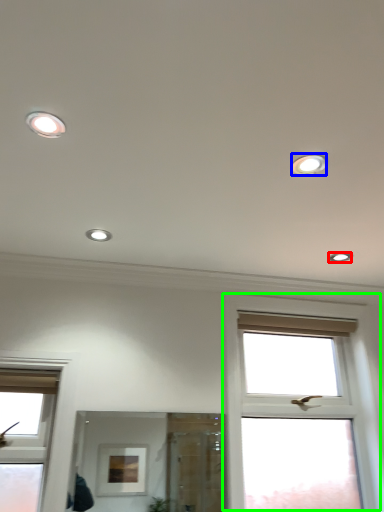
Question: Which object is positioned farthest from dot (highlighted by a red box)? Select from dot (highlighted by a blue box) and window (highlighted by a green box).

Choices:
 (A) dot
 (B) window

Answer: (A)